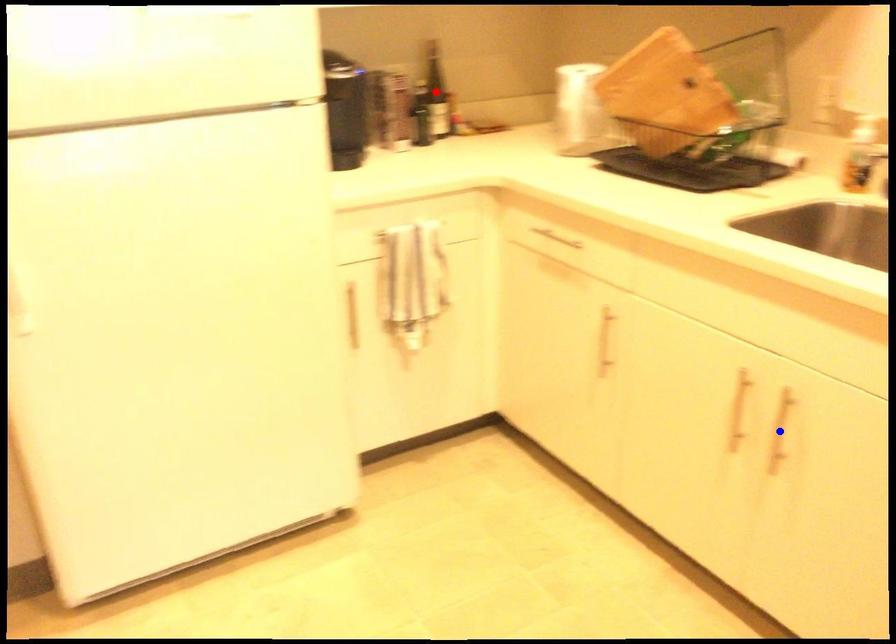
Question: Which of the two points in the image is closer to the camera?

Choices:
 (A) Blue point is closer.
 (B) Red point is closer.

Answer: (A)